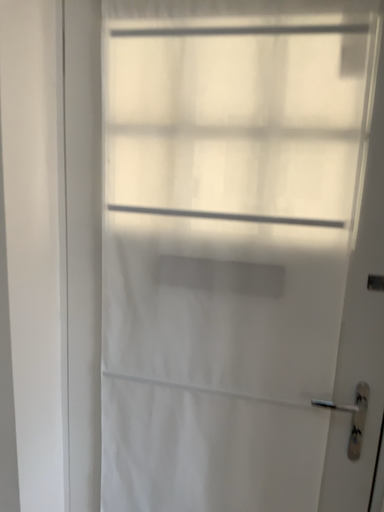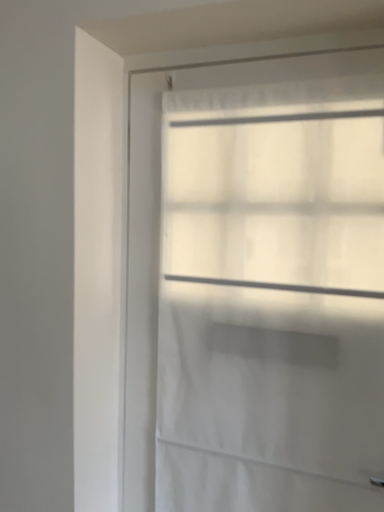
Question: Which way did the camera rotate in the video?

Choices:
 (A) rotated upward
 (B) rotated downward

Answer: (A)